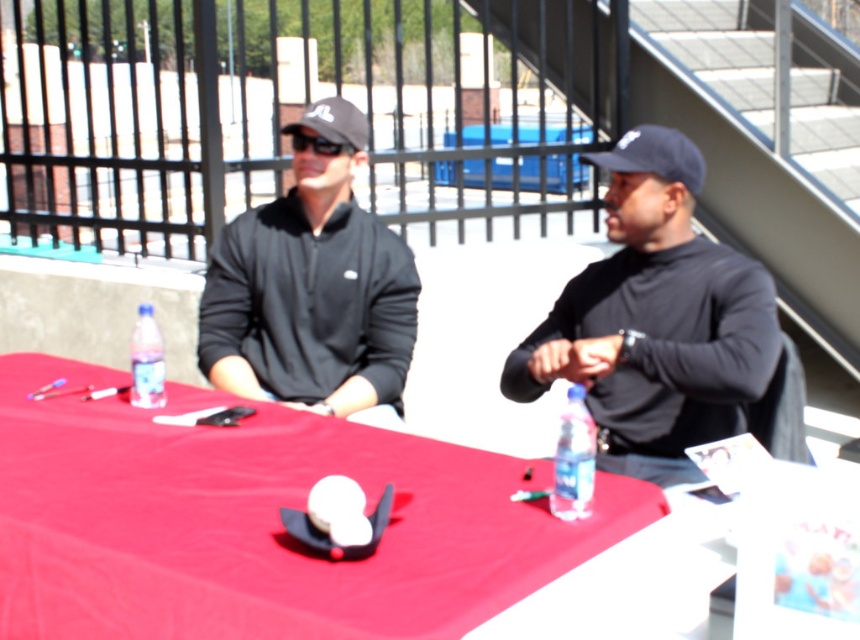
Question: Can you confirm if black matte turtleneck at right is positioned below translucent plastic bottle at table right?

Choices:
 (A) no
 (B) yes

Answer: (A)

Question: Considering the relative positions of red fabric table at center and clear plastic bottle at table left in the image provided, where is red fabric table at center located with respect to clear plastic bottle at table left?

Choices:
 (A) right
 (B) left

Answer: (A)

Question: Which of these objects is positioned farthest from the matte black cap at center?

Choices:
 (A) red fabric table at center
 (B) black matte baseball cap at center
 (C) black plastic sunglasses at upper center
 (D) black fabric baseball cap at center

Answer: (D)

Question: Which object is farther from the camera taking this photo?

Choices:
 (A) matte black cap at center
 (B) black plastic sunglasses at upper center
 (C) black matte turtleneck at right

Answer: (B)

Question: Which object is the farthest from the black plastic sunglasses at upper center?

Choices:
 (A) clear plastic bottle at table left
 (B) black matte turtleneck at right
 (C) translucent plastic bottle at table right

Answer: (C)

Question: Is black matte baseball cap at center further to the viewer compared to black plastic sunglasses at upper center?

Choices:
 (A) yes
 (B) no

Answer: (B)